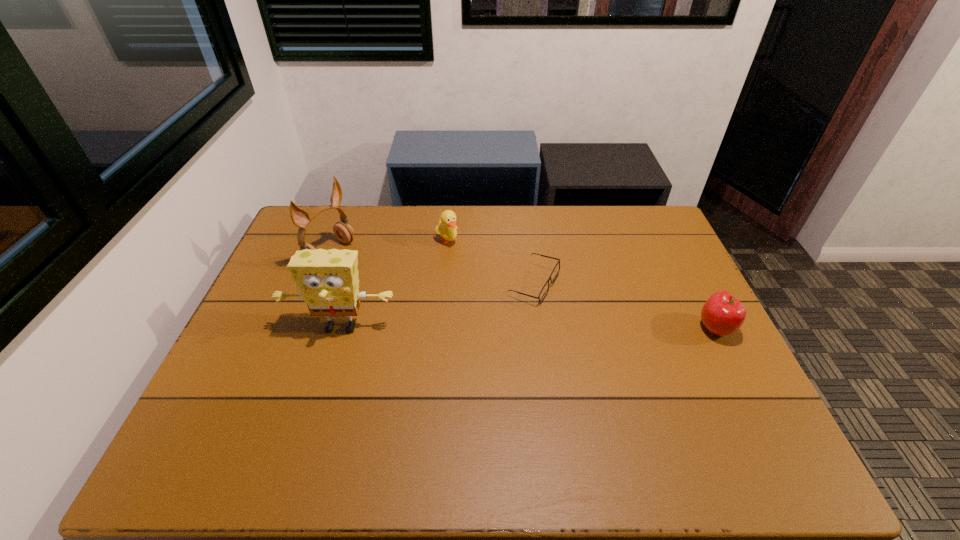
Locate an element on the screen. sponge is located at coordinates (328, 282).

Where is `apple`? The height and width of the screenshot is (540, 960). apple is located at coordinates (722, 314).

Image resolution: width=960 pixels, height=540 pixels. I want to click on the third object from right to left, so click(446, 227).

You are a GUI agent. You are given a task and a screenshot of the screen. Output one action in this format:
    pyautogui.click(x=<x>, y=<y>)
    Task: Click on the earphone
    
    Given the screenshot: What is the action you would take?
    pyautogui.click(x=343, y=231)

Locate an element on the screen. the second object from right to left is located at coordinates (545, 289).

The height and width of the screenshot is (540, 960). I want to click on the shortest object, so click(545, 289).

Locate an element on the screen. The width and height of the screenshot is (960, 540). vacant region located on the face of the sponge is located at coordinates (322, 392).

At what (x,y) coordinates should I click in order to perform the action: click on free region located 0.190m on the back of the rightmost object. Please return your answer as a coordinate pair (x, y). The height and width of the screenshot is (540, 960). Looking at the image, I should click on click(x=684, y=269).

At what (x,y) coordinates should I click in order to perform the action: click on free spot located 0.180m on the front-facing side of the third object from left to right. Please return your answer as a coordinate pair (x, y). The image size is (960, 540). Looking at the image, I should click on (476, 282).

Image resolution: width=960 pixels, height=540 pixels. Find the location of `vacant space located on the front-facing side of the third object from left to right`. vacant space located on the front-facing side of the third object from left to right is located at coordinates (479, 286).